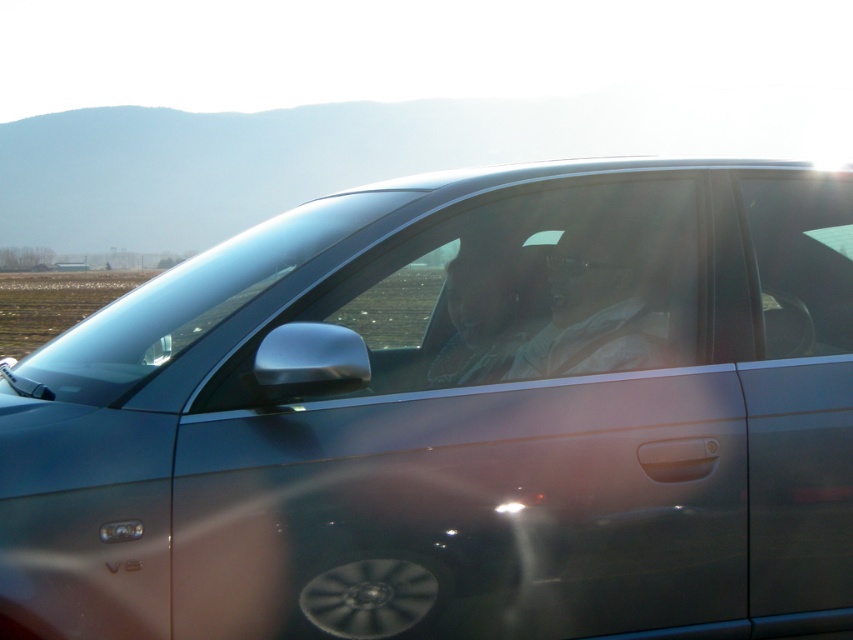
You are a car mechanic checking the distance between the transparent glass window at center and the matte plastic face at center in the car. According to the manufacturer specifications, the recommended distance between these two components is 3 inches. Is the current distance within the acceptable range?

The transparent glass window at center and matte plastic face at center are 3.22 inches apart from each other. Since the manufacturer recommends 3 inches, the current distance exceeds the specified range by 0.22 inches.

You are a passenger in the car and want to see the sunset outside through the window. Can you see the sunset through the transparent glass window at center while sitting in the seat with the matte gray shirt at center?

The transparent glass window at center is in front of the matte gray shirt at center, so yes, you can see the sunset through the transparent glass window at center while sitting in the seat with the matte gray shirt at center because the window is directly in front of you.